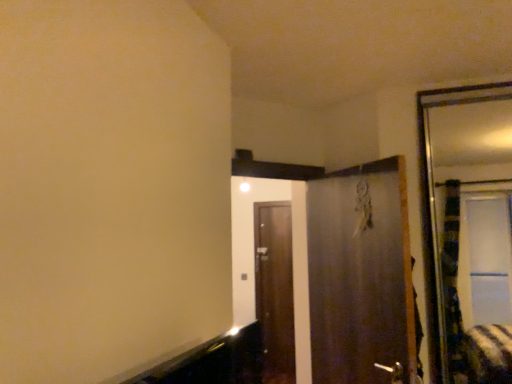
Question: From a real-world perspective, is silver metallic door handle at lower center positioned under metallic silver door at center, arranged as the first door when viewed from the front, based on gravity?

Choices:
 (A) no
 (B) yes

Answer: (B)

Question: Is silver metallic door handle at lower center positioned before metallic silver door at center, arranged as the second door when viewed from the back?

Choices:
 (A) no
 (B) yes

Answer: (B)

Question: Can you confirm if silver metallic door handle at lower center is wider than metallic silver door at center, arranged as the second door when viewed from the back?

Choices:
 (A) yes
 (B) no

Answer: (B)

Question: From the image's perspective, is silver metallic door handle at lower center above metallic silver door at center, arranged as the second door when viewed from the back?

Choices:
 (A) no
 (B) yes

Answer: (A)

Question: Is silver metallic door handle at lower center positioned behind metallic silver door at center, arranged as the first door when viewed from the front?

Choices:
 (A) no
 (B) yes

Answer: (A)

Question: Could you tell me if silver metallic door handle at lower center is turned towards metallic silver door at center, arranged as the second door when viewed from the back?

Choices:
 (A) yes
 (B) no

Answer: (A)

Question: Could you tell me if brown wooden door at center, the first door from the back, is facing silver metallic door handle at lower center?

Choices:
 (A) yes
 (B) no

Answer: (B)

Question: Is brown wooden door at center, the second door positioned from the front, shorter than silver metallic door handle at lower center?

Choices:
 (A) no
 (B) yes

Answer: (A)

Question: Does brown wooden door at center, the first door from the back, have a larger size compared to silver metallic door handle at lower center?

Choices:
 (A) no
 (B) yes

Answer: (B)

Question: Is silver metallic door handle at lower center completely or partially inside brown wooden door at center, the first door from the back?

Choices:
 (A) yes
 (B) no

Answer: (B)

Question: From a real-world perspective, is brown wooden door at center, the first door from the back, located higher than silver metallic door handle at lower center?

Choices:
 (A) yes
 (B) no

Answer: (A)

Question: Considering the relative sizes of brown wooden door at center, the second door positioned from the front, and silver metallic door handle at lower center in the image provided, is brown wooden door at center, the second door positioned from the front, wider than silver metallic door handle at lower center?

Choices:
 (A) yes
 (B) no

Answer: (B)

Question: Is brown wooden door at center, the second door positioned from the front, facing towards metallic silver door at center, arranged as the first door when viewed from the front?

Choices:
 (A) yes
 (B) no

Answer: (B)